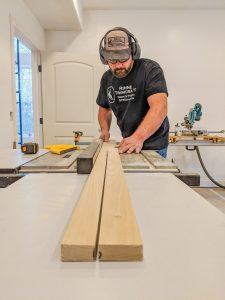
This screenshot has width=225, height=300. Find the location of `black handle`. black handle is located at coordinates (190, 149).